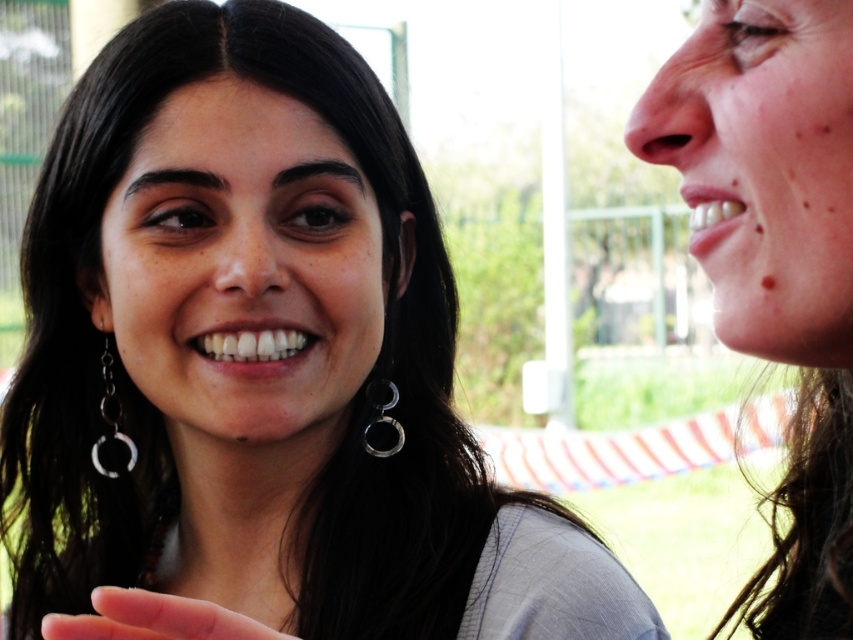
Does smooth skin hand at lower left have a lesser width compared to silver metallic earring at left?

No.

Is smooth skin hand at lower left shorter than silver metallic earring at left?

Yes.

Which is behind, point (120, 628) or point (105, 384)?

Positioned behind is point (105, 384).

Find the location of `smooth skin hand at lower left`. smooth skin hand at lower left is located at coordinates (154, 618).

Which is above, smooth skin face at right or silver metallic earring at left?

smooth skin face at right is above.

Is smooth skin face at right behind silver metallic earring at left?

No, it is not.

Locate an element on the screen. Image resolution: width=853 pixels, height=640 pixels. smooth skin face at right is located at coordinates (x=775, y=259).

Does point (804, 198) come in front of point (161, 636)?

No, (804, 198) is behind (161, 636).

Does point (836, 461) come behind point (146, 604)?

Yes, it is behind point (146, 604).

I want to click on smooth skin face at right, so click(775, 259).